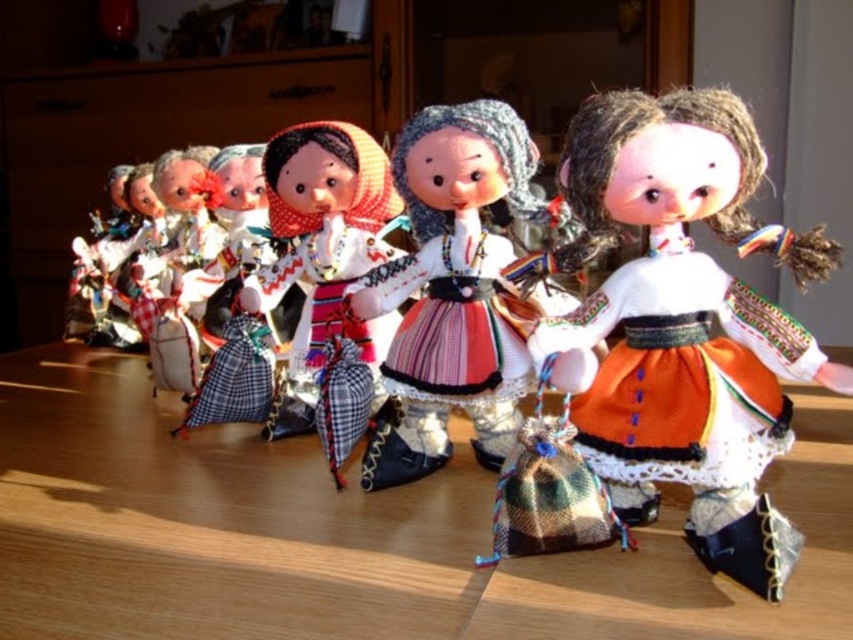
Question: Which object is positioned farthest from the plaid fabric skirt at center?

Choices:
 (A) matte fabric doll at center
 (B) orange fabric skirt at center
 (C) multicolored fabric dress at center
 (D) matte orange fabric dress at center

Answer: (D)

Question: Does matte fabric doll at center have a larger size compared to plaid fabric skirt at center?

Choices:
 (A) yes
 (B) no

Answer: (A)

Question: Which object is closer to the camera taking this photo?

Choices:
 (A) multicolored fabric dress at center
 (B) orange fabric skirt at center

Answer: (B)

Question: Does wooden table at center have a lesser width compared to matte fabric doll at center?

Choices:
 (A) yes
 (B) no

Answer: (B)

Question: Which object is positioned farthest from the matte fabric doll at center?

Choices:
 (A) plaid fabric skirt at center
 (B) orange fabric skirt at center

Answer: (B)

Question: Is the position of wooden table at center less distant than that of multicolored fabric dress at center?

Choices:
 (A) yes
 (B) no

Answer: (A)